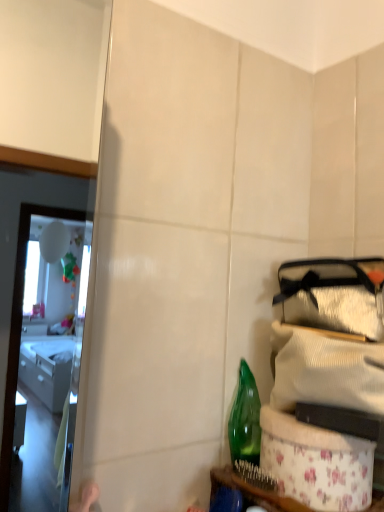
Question: Can you confirm if green glass bottle at lower right is shorter than floral fabric basket at lower right?

Choices:
 (A) no
 (B) yes

Answer: (A)

Question: From the image's perspective, is green glass bottle at lower right over floral fabric basket at lower right?

Choices:
 (A) no
 (B) yes

Answer: (B)

Question: Is green glass bottle at lower right taller than floral fabric basket at lower right?

Choices:
 (A) yes
 (B) no

Answer: (A)

Question: Could you tell me if green glass bottle at lower right is facing floral fabric basket at lower right?

Choices:
 (A) no
 (B) yes

Answer: (A)

Question: Does green glass bottle at lower right have a larger size compared to floral fabric basket at lower right?

Choices:
 (A) no
 (B) yes

Answer: (A)

Question: Can you confirm if green glass bottle at lower right is wider than floral fabric basket at lower right?

Choices:
 (A) yes
 (B) no

Answer: (B)

Question: Is floral fabric basket at lower right positioned far away from green glass bottle at lower right?

Choices:
 (A) no
 (B) yes

Answer: (A)

Question: Would you say floral fabric basket at lower right is outside green glass bottle at lower right?

Choices:
 (A) no
 (B) yes

Answer: (B)

Question: From the image's perspective, is floral fabric basket at lower right located above green glass bottle at lower right?

Choices:
 (A) no
 (B) yes

Answer: (A)

Question: Considering the relative positions of floral fabric basket at lower right and green glass bottle at lower right in the image provided, is floral fabric basket at lower right to the right of green glass bottle at lower right from the viewer's perspective?

Choices:
 (A) yes
 (B) no

Answer: (A)

Question: Is green glass bottle at lower right a part of floral fabric basket at lower right?

Choices:
 (A) yes
 (B) no

Answer: (B)

Question: From a real-world perspective, is floral fabric basket at lower right on top of green glass bottle at lower right?

Choices:
 (A) no
 (B) yes

Answer: (A)

Question: In the image, is green glass bottle at lower right positioned in front of or behind floral fabric basket at lower right?

Choices:
 (A) front
 (B) behind

Answer: (B)